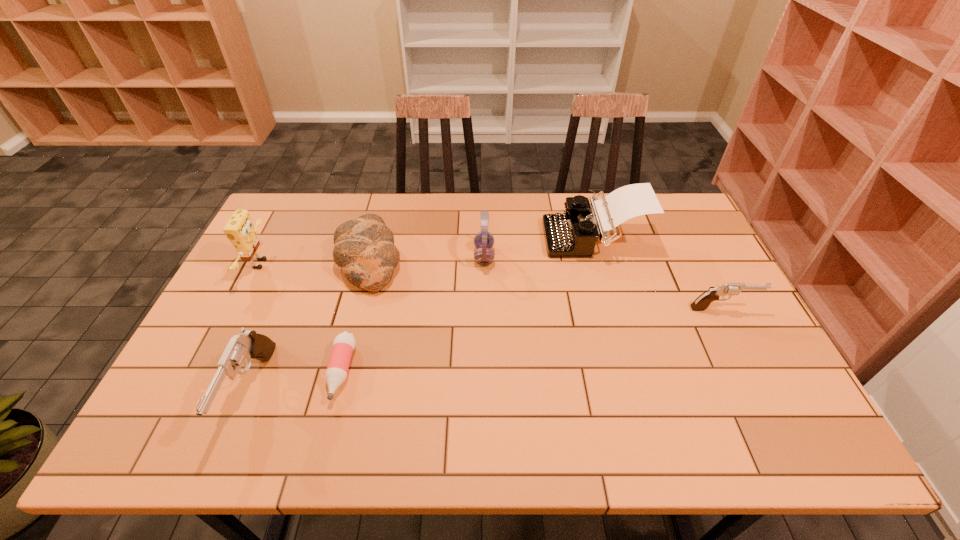
The width and height of the screenshot is (960, 540). I want to click on bottle that is positioned at the near edge, so click(x=343, y=345).

You are a GUI agent. You are given a task and a screenshot of the screen. Output one action in this format:
    pyautogui.click(x=<x>, y=<y>)
    Task: Click on the object situated at the left edge
    
    Given the screenshot: What is the action you would take?
    pyautogui.click(x=240, y=230)

The width and height of the screenshot is (960, 540). Find the location of `object that is at the right edge`. object that is at the right edge is located at coordinates (701, 303).

Locate an element on the screen. free region at the far edge is located at coordinates (384, 205).

Locate an element on the screen. Image resolution: width=960 pixels, height=540 pixels. free point at the near edge is located at coordinates (403, 384).

The height and width of the screenshot is (540, 960). Find the location of `vacant space at the left edge of the desktop`. vacant space at the left edge of the desktop is located at coordinates (296, 253).

The image size is (960, 540). In the image, there is a desktop. Identify the location of vacant space at the right edge. (703, 284).

Locate an element on the screen. Image resolution: width=960 pixels, height=540 pixels. vacant region between the bottle and the third object from right to left is located at coordinates (413, 314).

Locate an element on the screen. empty space between the third object from right to left and the second object from right to left is located at coordinates (539, 247).

This screenshot has height=540, width=960. I want to click on vacant area that lies between the bread and the leftmost object, so click(315, 261).